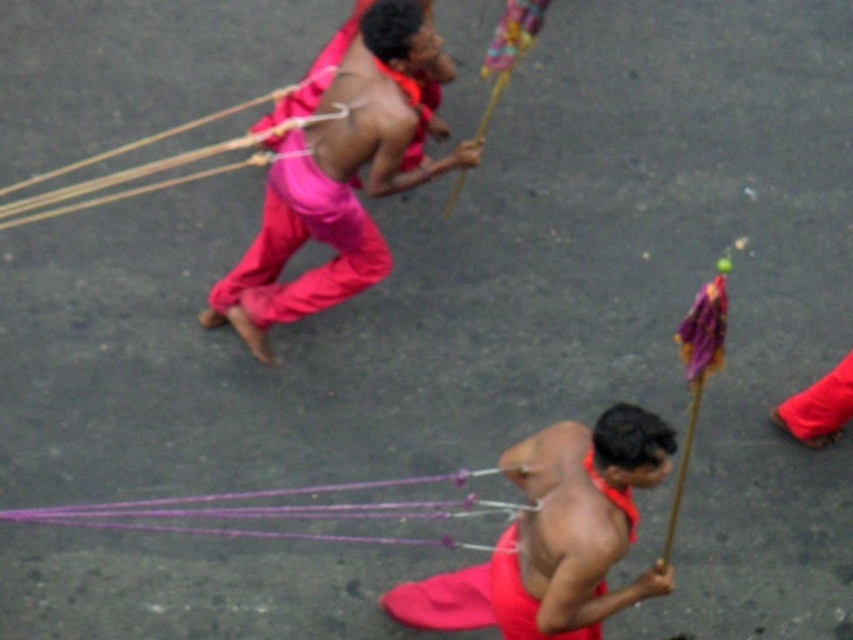
Based on the scene description, where is the matte pink pants at upper center located in terms of coordinates?

The matte pink pants at upper center are located at coordinates point (x=338, y=180).

You are a photographer positioned to the right of the scene. You want to capture a photo where the purple string at lower center is visible in front of the matte pink pants at upper center. Is this possible given their current positions?

The purple string at lower center is currently behind the matte pink pants at upper center, so it would not be visible in front of them in the current arrangement.